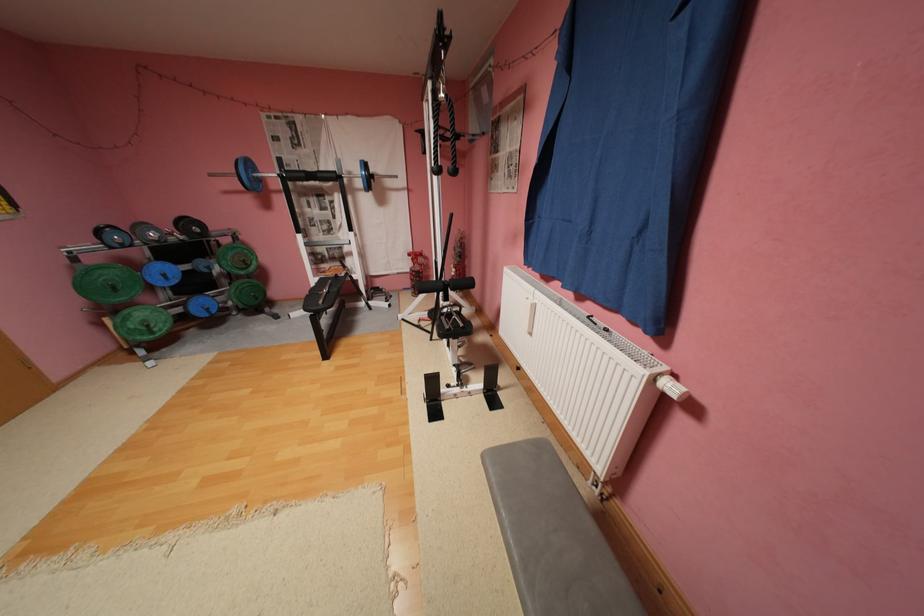
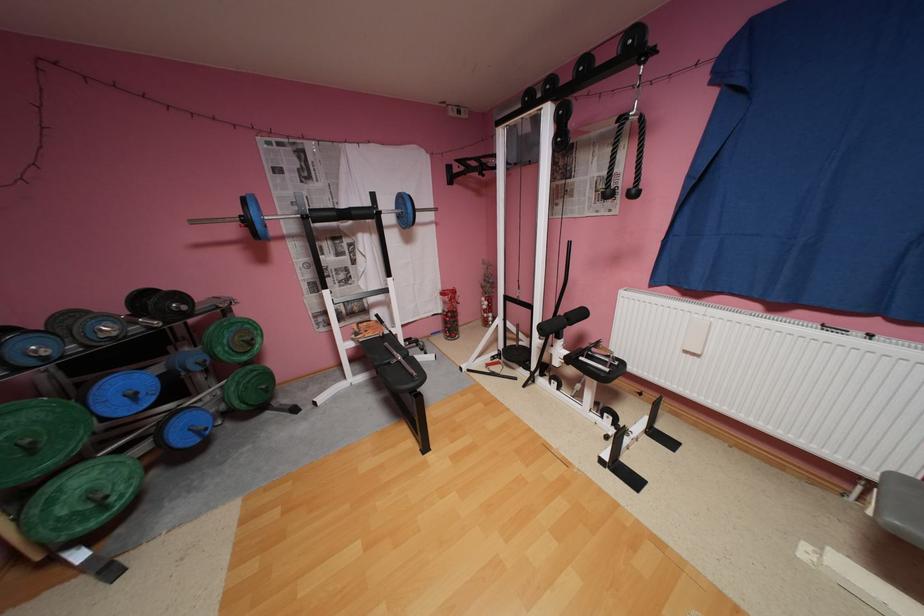
In the second image, find the point that corresponds to point 337,274 in the first image.

(380, 334)